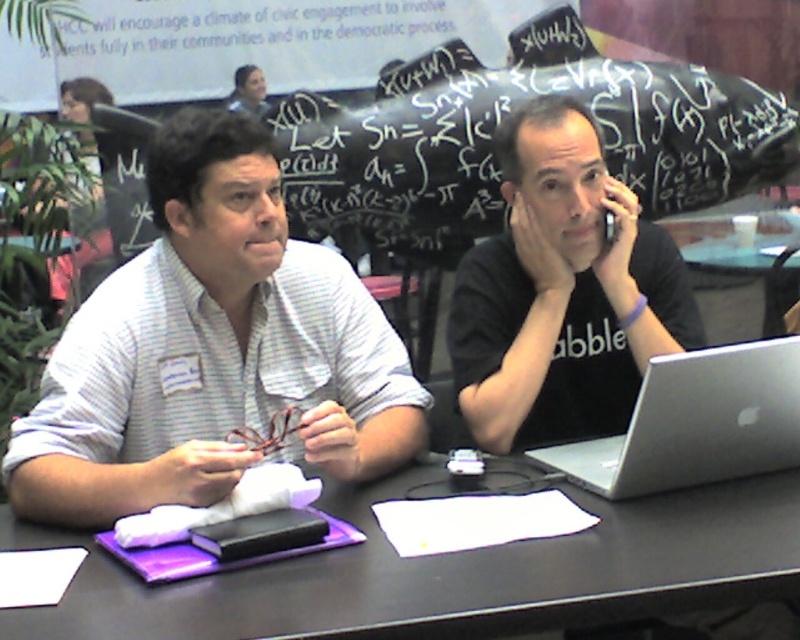
Question: Which object is the closest to the matte black shirt at upper center?

Choices:
 (A) black matte table at center
 (B) silver metallic smartphone at upper center

Answer: (B)

Question: Which point is farther from the camera taking this photo?

Choices:
 (A) (124, 355)
 (B) (440, 156)
 (C) (260, 83)

Answer: (C)

Question: Is the position of black chalkboard at center more distant than that of silver metallic laptop at right?

Choices:
 (A) yes
 (B) no

Answer: (A)

Question: Which of the following is the farthest from the observer?

Choices:
 (A) black matte shirt at center
 (B) silver metallic smartphone at upper center
 (C) black matte table at center
 (D) matte black shirt at upper center

Answer: (D)

Question: Where is black matte table at center located in relation to matte black shirt at upper center in the image?

Choices:
 (A) above
 (B) below

Answer: (B)

Question: Can you confirm if black chalkboard at center is positioned to the left of silver metallic laptop at right?

Choices:
 (A) yes
 (B) no

Answer: (A)